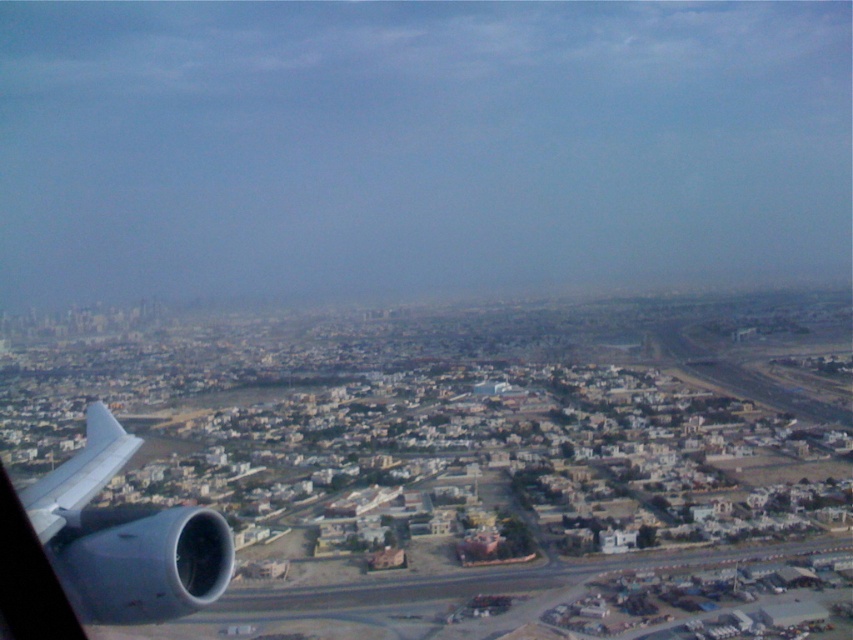
Question: Is the position of metallic gray engine at bottom left less distant than that of white matte wing at lower left?

Choices:
 (A) yes
 (B) no

Answer: (A)

Question: Which point appears closest to the camera in this image?

Choices:
 (A) (100, 538)
 (B) (74, 477)

Answer: (A)

Question: From the image, what is the correct spatial relationship of metallic gray engine at bottom left in relation to white matte wing at lower left?

Choices:
 (A) left
 (B) right

Answer: (B)

Question: Where is metallic gray engine at bottom left located in relation to white matte wing at lower left in the image?

Choices:
 (A) right
 (B) left

Answer: (A)

Question: Among these points, which one is nearest to the camera?

Choices:
 (A) (129, 449)
 (B) (141, 592)

Answer: (B)